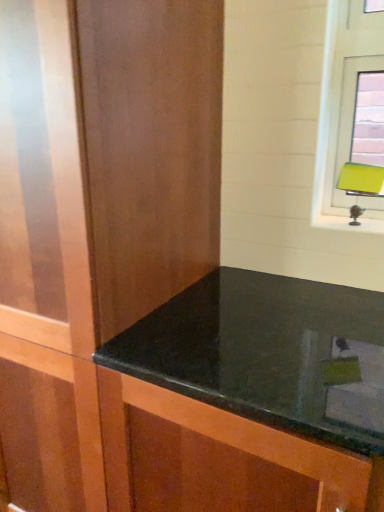
Question: Can you confirm if green matte table lamp at upper right is smaller than matte wood dresser at center?

Choices:
 (A) no
 (B) yes

Answer: (B)

Question: From the image's perspective, would you say green matte table lamp at upper right is positioned over matte wood dresser at center?

Choices:
 (A) no
 (B) yes

Answer: (B)

Question: Is green matte table lamp at upper right bigger than matte wood dresser at center?

Choices:
 (A) no
 (B) yes

Answer: (A)

Question: Does green matte table lamp at upper right have a lesser height compared to matte wood dresser at center?

Choices:
 (A) no
 (B) yes

Answer: (B)

Question: Can you confirm if green matte table lamp at upper right is positioned to the right of matte wood dresser at center?

Choices:
 (A) yes
 (B) no

Answer: (A)

Question: Is green matte table lamp at upper right touching matte wood dresser at center?

Choices:
 (A) no
 (B) yes

Answer: (A)

Question: Is green matte table lamp at upper right wider than black granite countertop at center?

Choices:
 (A) yes
 (B) no

Answer: (B)

Question: Is green matte table lamp at upper right to the right of black granite countertop at center from the viewer's perspective?

Choices:
 (A) yes
 (B) no

Answer: (A)

Question: Is green matte table lamp at upper right positioned behind black granite countertop at center?

Choices:
 (A) no
 (B) yes

Answer: (B)

Question: From a real-world perspective, does green matte table lamp at upper right stand above black granite countertop at center?

Choices:
 (A) yes
 (B) no

Answer: (A)

Question: From a real-world perspective, does green matte table lamp at upper right sit lower than black granite countertop at center?

Choices:
 (A) no
 (B) yes

Answer: (A)

Question: Is green matte table lamp at upper right looking in the opposite direction of black granite countertop at center?

Choices:
 (A) yes
 (B) no

Answer: (B)

Question: From a real-world perspective, is matte wood dresser at center beneath green matte table lamp at upper right?

Choices:
 (A) no
 (B) yes

Answer: (B)